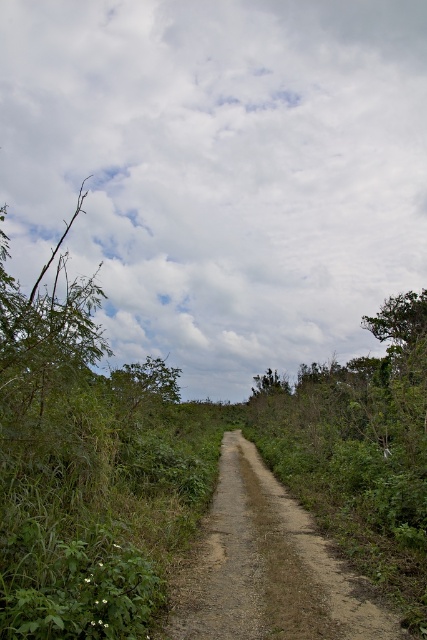
Question: Where is brown dirt track at center located in relation to green leafy tree at center in the image?

Choices:
 (A) left
 (B) right

Answer: (B)

Question: Is brown dirt track at center wider than green leafy tree at center?

Choices:
 (A) yes
 (B) no

Answer: (B)

Question: Considering the relative positions of brown dirt track at center and green leafy tree at center in the image provided, where is brown dirt track at center located with respect to green leafy tree at center?

Choices:
 (A) below
 (B) above

Answer: (A)